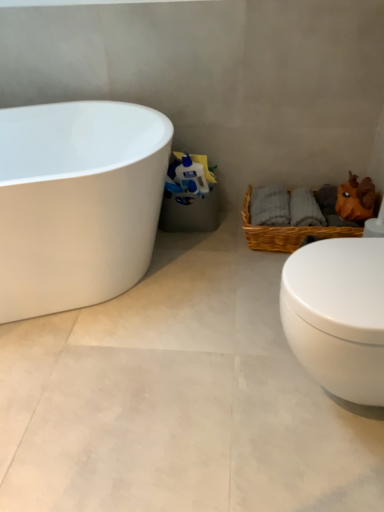
Question: Does white glossy bathtub at left have a greater width compared to white glossy toilet paper at center?

Choices:
 (A) no
 (B) yes

Answer: (B)

Question: Is white glossy bathtub at left taller than white glossy toilet paper at center?

Choices:
 (A) no
 (B) yes

Answer: (B)

Question: Is white glossy bathtub at left closer to camera compared to white glossy toilet paper at center?

Choices:
 (A) no
 (B) yes

Answer: (B)

Question: Is white glossy bathtub at left positioned far away from white glossy toilet paper at center?

Choices:
 (A) no
 (B) yes

Answer: (A)

Question: Is white glossy bathtub at left smaller than white glossy toilet paper at center?

Choices:
 (A) no
 (B) yes

Answer: (A)

Question: In the image, is white glossy toilet at lower right positioned in front of or behind woven brown picnic basket at lower right?

Choices:
 (A) front
 (B) behind

Answer: (A)

Question: Is white glossy toilet at lower right to the left or to the right of woven brown picnic basket at lower right in the image?

Choices:
 (A) left
 (B) right

Answer: (A)

Question: Is white glossy toilet at lower right wider or thinner than woven brown picnic basket at lower right?

Choices:
 (A) wide
 (B) thin

Answer: (B)

Question: Does point 347,354 appear closer or farther from the camera than point 284,230?

Choices:
 (A) closer
 (B) farther

Answer: (A)

Question: Is white glossy bathtub at left bigger or smaller than white glossy toilet paper at center?

Choices:
 (A) small
 (B) big

Answer: (B)

Question: Relative to white glossy toilet paper at center, is white glossy bathtub at left in front or behind?

Choices:
 (A) front
 (B) behind

Answer: (A)

Question: From the image's perspective, relative to white glossy toilet paper at center, is white glossy bathtub at left above or below?

Choices:
 (A) below
 (B) above

Answer: (A)

Question: In terms of height, does white glossy bathtub at left look taller or shorter compared to white glossy toilet paper at center?

Choices:
 (A) tall
 (B) short

Answer: (A)

Question: From a real-world perspective, is woven brown picnic basket at lower right above or below white glossy toilet at lower right?

Choices:
 (A) below
 (B) above

Answer: (A)

Question: Looking at the image, does woven brown picnic basket at lower right seem bigger or smaller compared to white glossy toilet at lower right?

Choices:
 (A) small
 (B) big

Answer: (A)